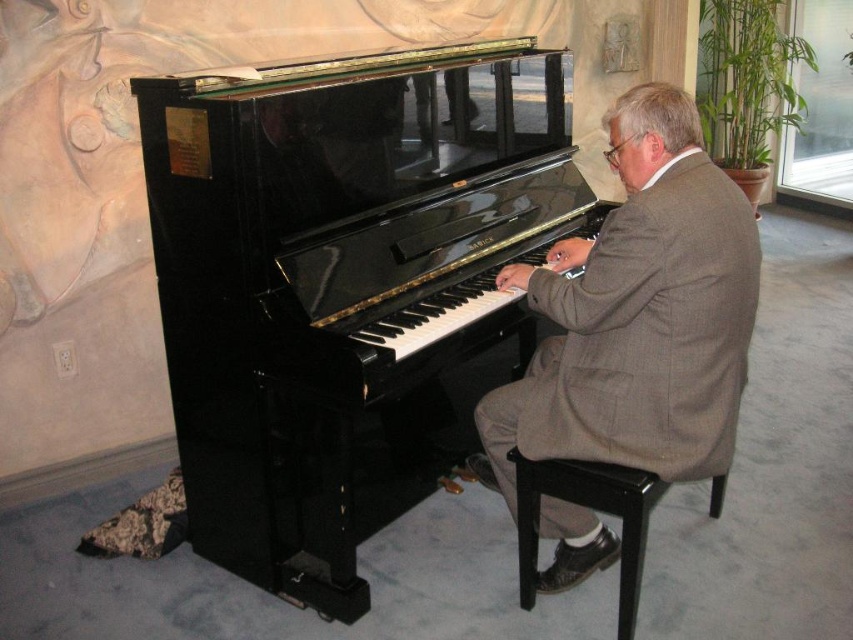
Question: Is gray wool suit at center smaller than black wood stool at lower center?

Choices:
 (A) no
 (B) yes

Answer: (A)

Question: Can you confirm if gray wool suit at center is positioned to the left of black wood stool at lower center?

Choices:
 (A) no
 (B) yes

Answer: (A)

Question: Observing the image, what is the correct spatial positioning of black polished piano at center in reference to black wood stool at lower center?

Choices:
 (A) below
 (B) above

Answer: (B)

Question: Among these objects, which one is nearest to the camera?

Choices:
 (A) gray wool suit at center
 (B) black wood stool at lower center
 (C) black polished piano at center

Answer: (A)

Question: Which of the following is the closest to the observer?

Choices:
 (A) (660, 333)
 (B) (276, 493)
 (C) (511, 458)

Answer: (A)

Question: Which object appears closest to the camera in this image?

Choices:
 (A) black wood stool at lower center
 (B) black polished piano at center
 (C) gray wool suit at center

Answer: (C)